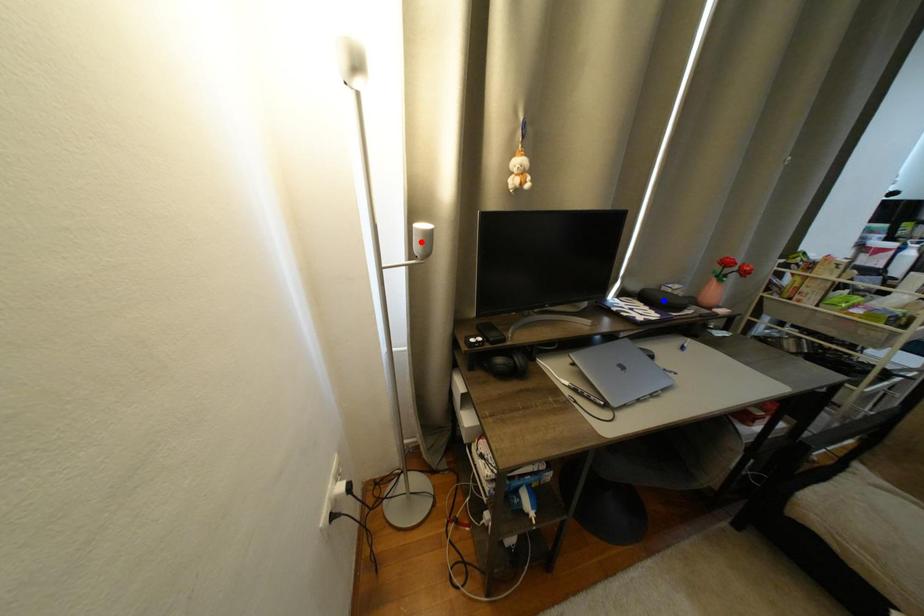
Question: Two points are marked on the image. Which point is closer to the camera?

Choices:
 (A) Blue point is closer.
 (B) Red point is closer.

Answer: (B)